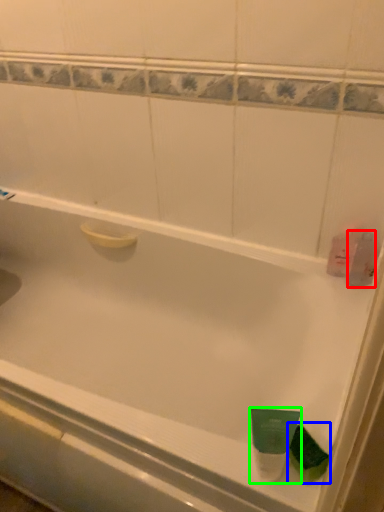
Question: Estimate the real-world distances between objects in this image. Which object is farther from mouthwash (highlighted by a red box), mouthwash (highlighted by a blue box) or mouthwash (highlighted by a green box)?

Choices:
 (A) mouthwash
 (B) mouthwash

Answer: (B)